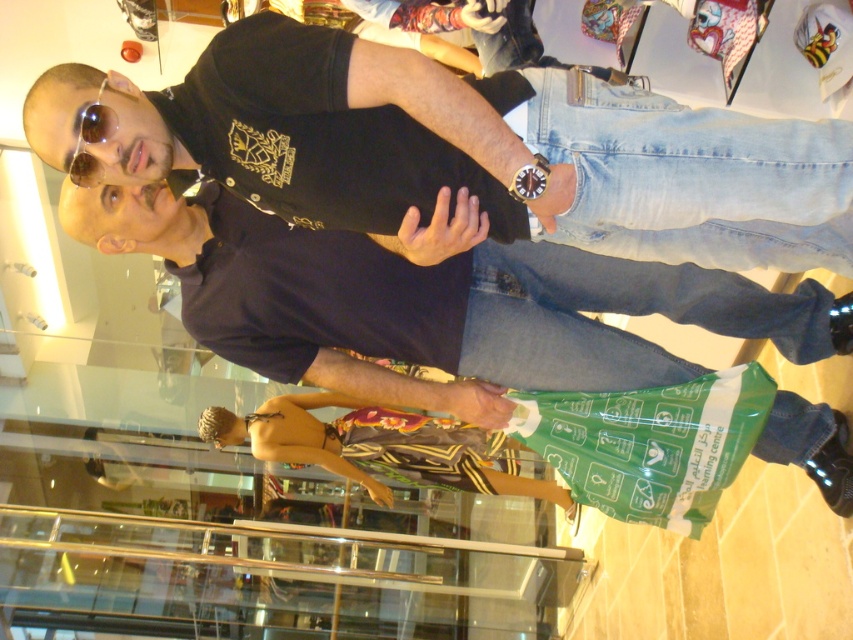
Based on the photo, can you confirm if black matte shirt at upper center is bigger than matte black shirt at center?

No, black matte shirt at upper center is not bigger than matte black shirt at center.

Does point (573, 168) lie in front of point (204, 234)?

Yes, it is in front of point (204, 234).

Measure the distance between point [805,141] and camera.

They are 4.75 feet apart.

Image resolution: width=853 pixels, height=640 pixels. I want to click on black matte shirt at upper center, so click(x=463, y=145).